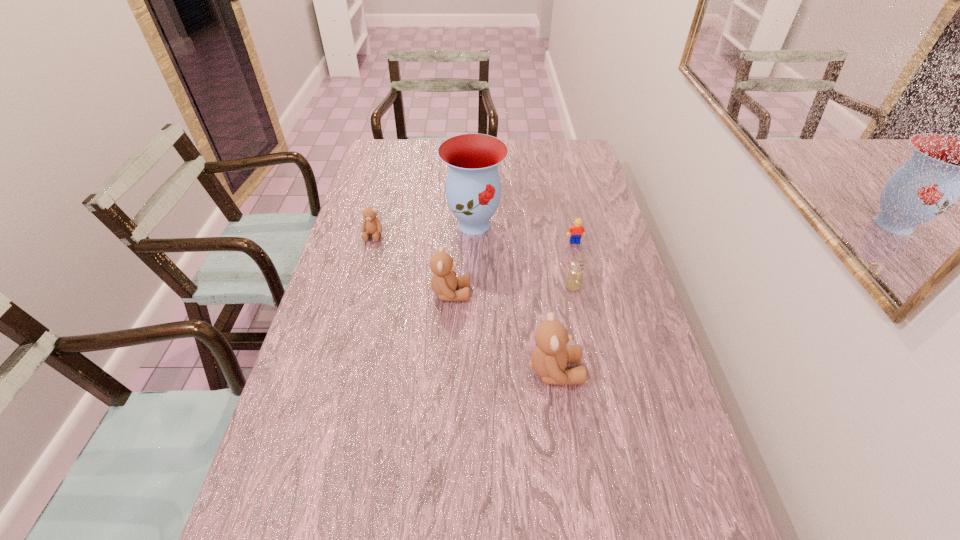
The image size is (960, 540). What are the coordinates of `free space at the near left corner of the desktop` in the screenshot? It's located at (318, 485).

Identify the location of vacant point at the far right corner. (562, 154).

At what (x,y) coordinates should I click in order to perform the action: click on vacant region between the tallest object and the nearest object. Please return your answer as a coordinate pair (x, y). The width and height of the screenshot is (960, 540). Looking at the image, I should click on (515, 298).

Identify the location of free spot between the farthest teddy bear and the rightmost teddy bear. The width and height of the screenshot is (960, 540). 464,303.

Identify the location of free space between the Lego and the leftmost teddy bear. This screenshot has width=960, height=540. (474, 239).

Image resolution: width=960 pixels, height=540 pixels. Find the location of `vacant space that is in between the rightmost teddy bear and the Lego`. vacant space that is in between the rightmost teddy bear and the Lego is located at coordinates (564, 307).

The width and height of the screenshot is (960, 540). Find the location of `free area in between the Lego and the rightmost teddy bear`. free area in between the Lego and the rightmost teddy bear is located at coordinates (564, 307).

At what (x,y) coordinates should I click in order to perform the action: click on free space that is in between the nearest teddy bear and the Lego. Please return your answer as a coordinate pair (x, y). Looking at the image, I should click on (564, 307).

Find the location of `free point between the shortest teddy bear and the nearest object`. free point between the shortest teddy bear and the nearest object is located at coordinates (464, 303).

You are a GUI agent. You are given a task and a screenshot of the screen. Output one action in this format:
    pyautogui.click(x=<x>, y=<y>)
    Task: Click on the free space between the nearest object and the Lego
    The width and height of the screenshot is (960, 540).
    Given the screenshot: What is the action you would take?
    pyautogui.click(x=564, y=307)